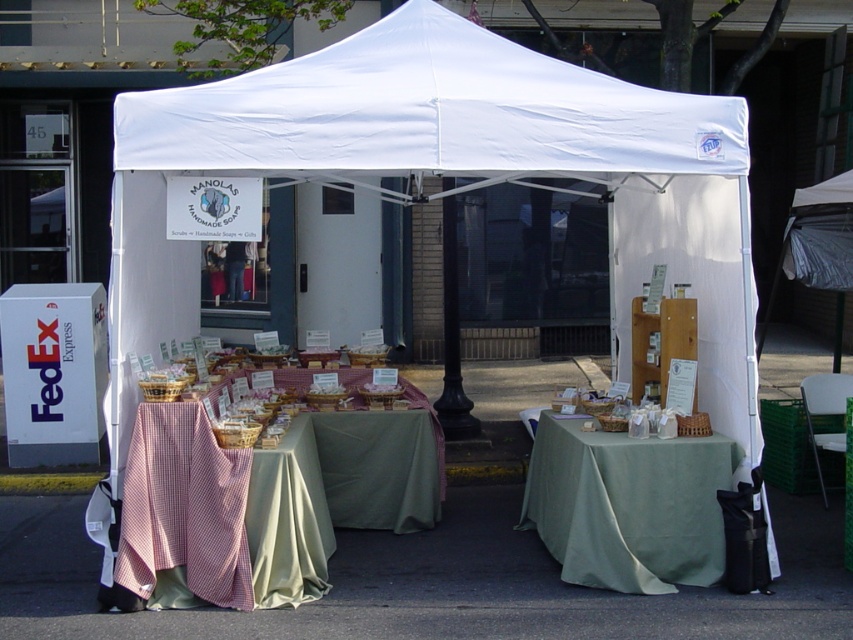
Question: Is white fabric canopy at upper center below green fabric table at center?

Choices:
 (A) yes
 (B) no

Answer: (B)

Question: Which object is positioned farthest from the green fabric table at center?

Choices:
 (A) checkered fabric table at center
 (B) white fabric canopy at upper center

Answer: (B)

Question: Which point appears farthest from the camera in this image?

Choices:
 (A) (360, 488)
 (B) (624, 150)

Answer: (A)

Question: From the image, what is the correct spatial relationship of checkered fabric table at center in relation to green fabric table at center?

Choices:
 (A) left
 (B) right

Answer: (A)

Question: Does checkered fabric table at center appear under green fabric table at center?

Choices:
 (A) no
 (B) yes

Answer: (B)

Question: Which point appears farthest from the camera in this image?

Choices:
 (A) [x=149, y=417]
 (B) [x=691, y=531]
 (C) [x=457, y=172]

Answer: (B)